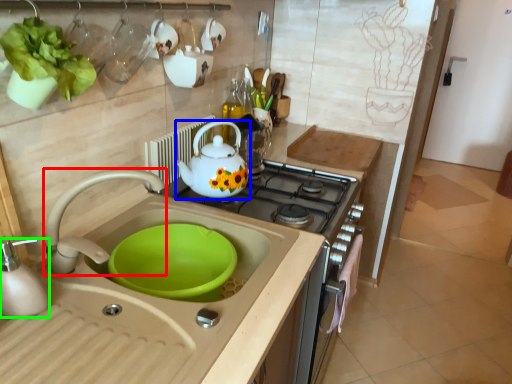
Question: Which is farther away from tap (highlighted by a red box)? teapot (highlighted by a blue box) or kitchen appliance (highlighted by a green box)?

Choices:
 (A) teapot
 (B) kitchen appliance

Answer: (A)